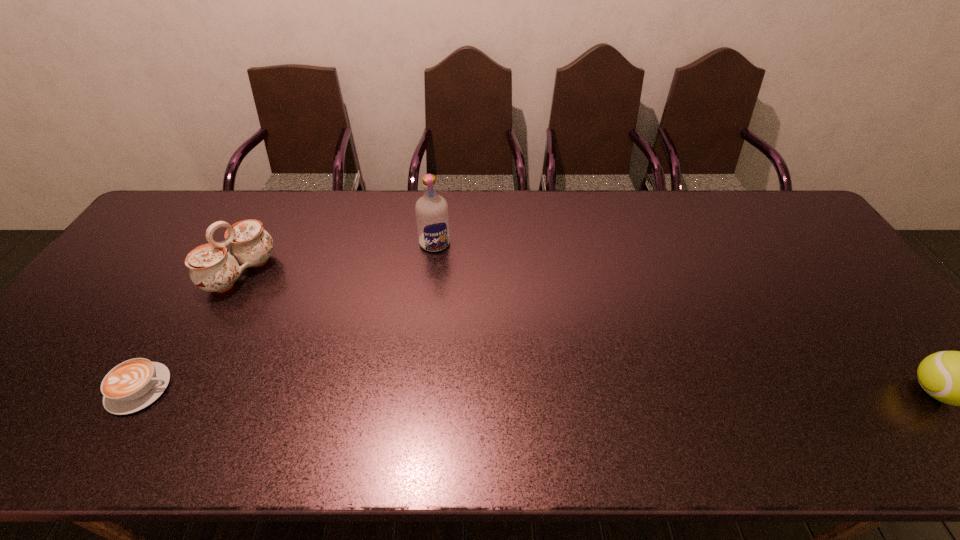
Where is `vacant space on the desktop that is between the cappuccino and the rightmost object and is positioned by the handle of the chinaware`? This screenshot has width=960, height=540. vacant space on the desktop that is between the cappuccino and the rightmost object and is positioned by the handle of the chinaware is located at coordinates (444, 390).

Identify the location of vacant spot on the desktop that is between the cappuccino and the third tallest object and is positioned on the label of the third object from left to right. This screenshot has height=540, width=960. (480, 390).